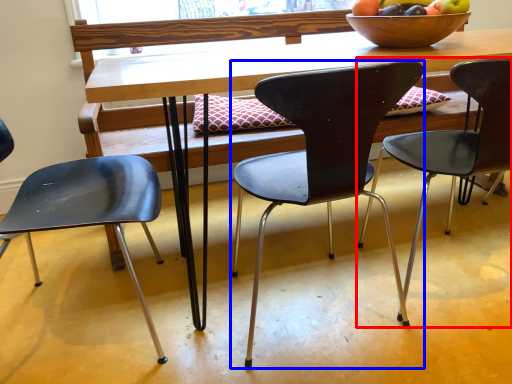
Question: Among these objects, which one is farthest to the camera, chair (highlighted by a red box) or chair (highlighted by a blue box)?

Choices:
 (A) chair
 (B) chair

Answer: (A)